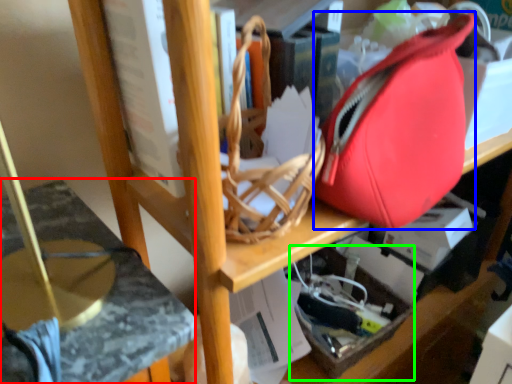
Question: Which object is the farthest from swivel chair (highlighted by a red box)? Choose among these: tote bag (highlighted by a blue box) or box (highlighted by a green box).

Choices:
 (A) tote bag
 (B) box

Answer: (B)